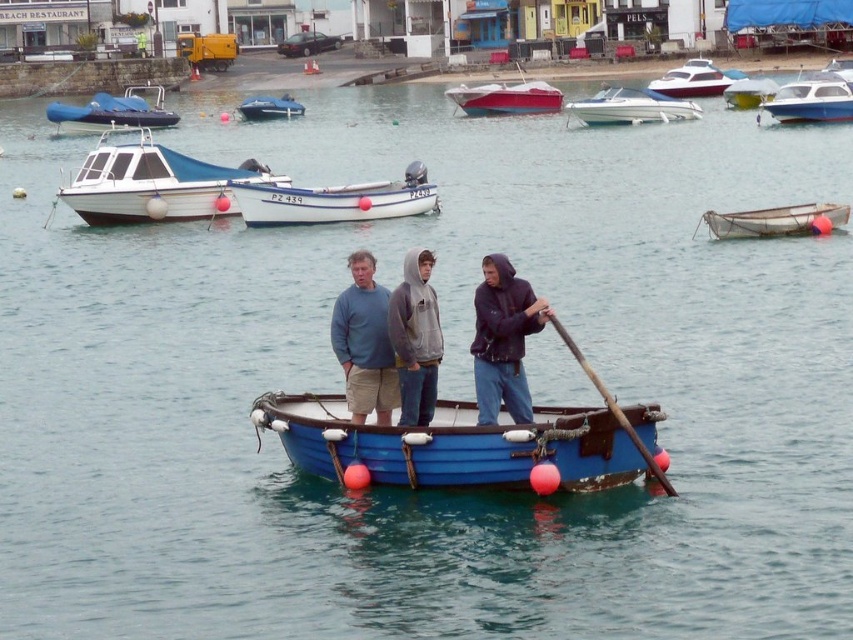
Based on the photo, you are standing on the dock and see the white plastic boat at center and the blue fabric boat at center. Which boat is closer to you?

The white plastic boat at center is closer to you because the blue fabric boat at center is behind it.

You are a photographer positioned at the edge of the dock, aiming to capture a closeup shot of the gray hoodie at center. Given that your camera has a focal length of 100mm and you are currently 5 meters away from the hoodie, will you need to adjust your position to ensure the hoodie fills the frame properly?

The gray hoodie at center is located at point coordinates which would require adjusting your position. However, without specific distance data from the coordinates, we can infer that being 5 meters away with a 100mm lens might be too far for a closeup. Move closer to 1 meter for better framing.

In the harbor scene, there is a blue rowboat with three people and other boats in the background. The point labeled gray hoodie at center is located at coordinates (415, 339). If you were standing at this point, which direction would you need to look to see the blue rowboat with three individuals?

The gray hoodie at center is located at point (415, 339). Since the blue rowboat with three individuals is in the foreground of the scene, someone standing at the gray hoodie at center would need to look forward to see the blue rowboat with three individuals.